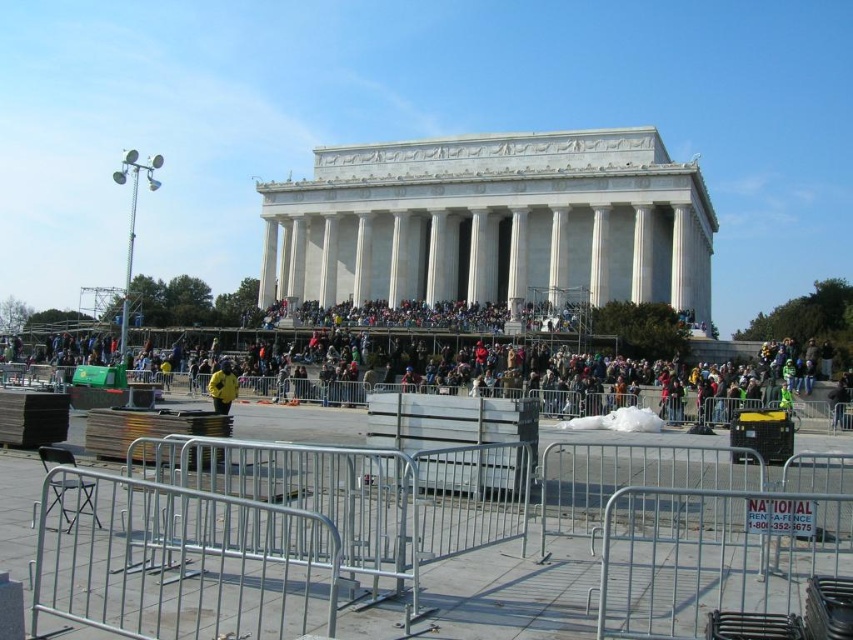
Image resolution: width=853 pixels, height=640 pixels. Describe the element at coordinates (503, 360) in the screenshot. I see `dark brown leather jacket at center` at that location.

From the picture: Does dark brown leather jacket at center have a greater width compared to yellow jacket at center?

Yes, dark brown leather jacket at center is wider than yellow jacket at center.

Does point (717, 368) come in front of point (234, 387)?

No, it is behind (234, 387).

Locate an element on the screen. The height and width of the screenshot is (640, 853). dark brown leather jacket at center is located at coordinates pos(503,360).

Does silver metallic fence at lower center lie behind dark brown leather jacket at center?

That is False.

You are a GUI agent. You are given a task and a screenshot of the screen. Output one action in this format:
    pyautogui.click(x=<x>, y=<y>)
    Task: Click on the silver metallic fence at lower center
    
    Given the screenshot: What is the action you would take?
    pyautogui.click(x=410, y=534)

Between silver metallic fence at lower center and yellow jacket at center, which one has less height?

Standing shorter between the two is yellow jacket at center.

Between point (679, 556) and point (218, 392), which one is positioned behind?

Positioned behind is point (218, 392).

Measure the distance between point [773,588] and camera.

A: 37.71 meters

At what (x,y) coordinates should I click in order to perform the action: click on silver metallic fence at lower center. Please return your answer as a coordinate pair (x, y). The width and height of the screenshot is (853, 640). Looking at the image, I should click on (410, 534).